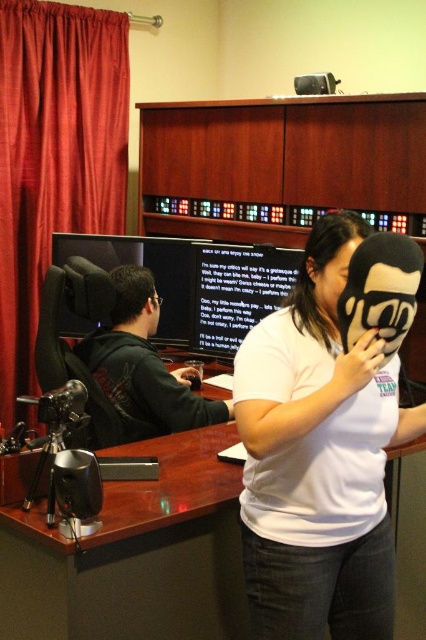
Does white matte mask at center have a greater height compared to matte black monitor at left?

Yes, white matte mask at center is taller than matte black monitor at left.

Between white matte mask at center and matte black monitor at left, which one appears on the left side from the viewer's perspective?

matte black monitor at left is more to the left.

What do you see at coordinates (317, 465) in the screenshot? I see `white matte mask at center` at bounding box center [317, 465].

Where is `white matte mask at center`? The width and height of the screenshot is (426, 640). white matte mask at center is located at coordinates (317, 465).

Which is more to the left, black matte hoodie at center or black glossy computer monitor at center?

Positioned to the left is black matte hoodie at center.

Is point (106, 385) less distant than point (233, 317)?

Yes, point (106, 385) is in front of point (233, 317).

This screenshot has width=426, height=640. Find the location of `black matte hoodie at center`. black matte hoodie at center is located at coordinates (143, 368).

From the picture: Is black glossy computer monitor at center to the right of matte black monitor at left from the viewer's perspective?

Indeed, black glossy computer monitor at center is positioned on the right side of matte black monitor at left.

Who is higher up, black glossy computer monitor at center or matte black monitor at left?

matte black monitor at left is above.

I want to click on black glossy computer monitor at center, so coord(235,292).